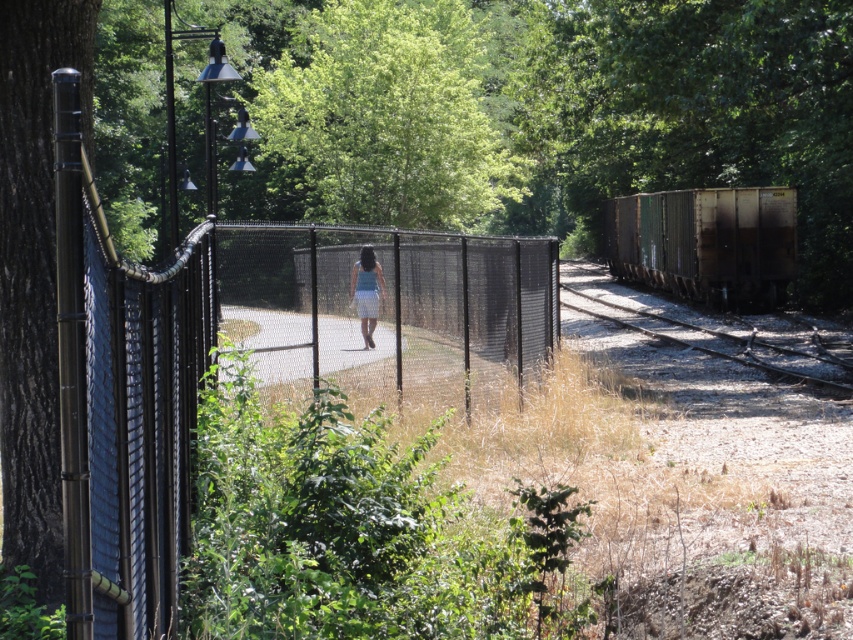
You are a pedestrian walking on the pathway and want to cross to the other side. The pathway is bordered by a chain link fence and a railway track. There is a rusty metal train car at right and a rusty metal train track at right. Which object should you avoid to stay safe?

You should avoid the rusty metal train car at right because it is located to the right of the rusty metal train track at right, meaning it is closer to the pathway and poses a potential obstruction or hazard.

You are standing at the point labeled point (22, 180) and want to walk to the point labeled point (274, 364). Given the scene described, which direction should you face to move towards your destination?

You should face towards the direction where the person is walking away from the camera, as point (274, 364) is behind point (22, 180) according to the spatial description.